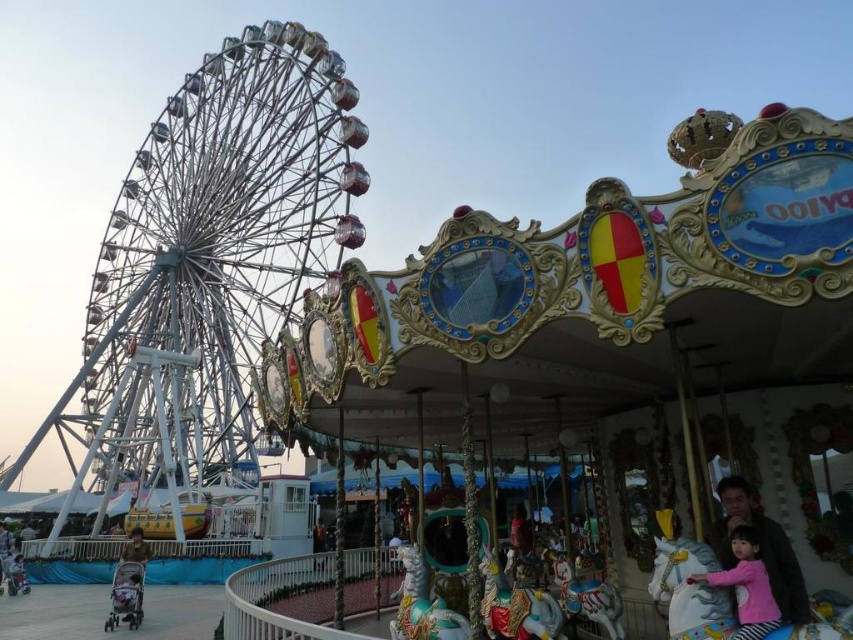
You are at the fairground and want to take a photo of both the white metallic ferris wheel at left and the pink fabric at center. Since you want both objects in the frame, will the ferris wheel fit in the photo if the pink fabric is already centered?

The white metallic ferris wheel at left is wider than the pink fabric at center, so it may not fully fit in the photo if the pink fabric is centered, as the ferris wheel requires more space.

You are standing at the entrance of the fairground and see the white metallic ferris wheel at left and the pink fabric at center. Which object is closer to you?

The white metallic ferris wheel at left is closer to you because the pink fabric at center is behind it, meaning the Ferris wheel is in front.

You are standing at the center of the fairground and see the white metallic ferris wheel at left and the matte pink dress at center. Which object is closer to your current position?

The matte pink dress at center is closer to your current position since it is at the center, while the white metallic ferris wheel at left is positioned further away on the left side.